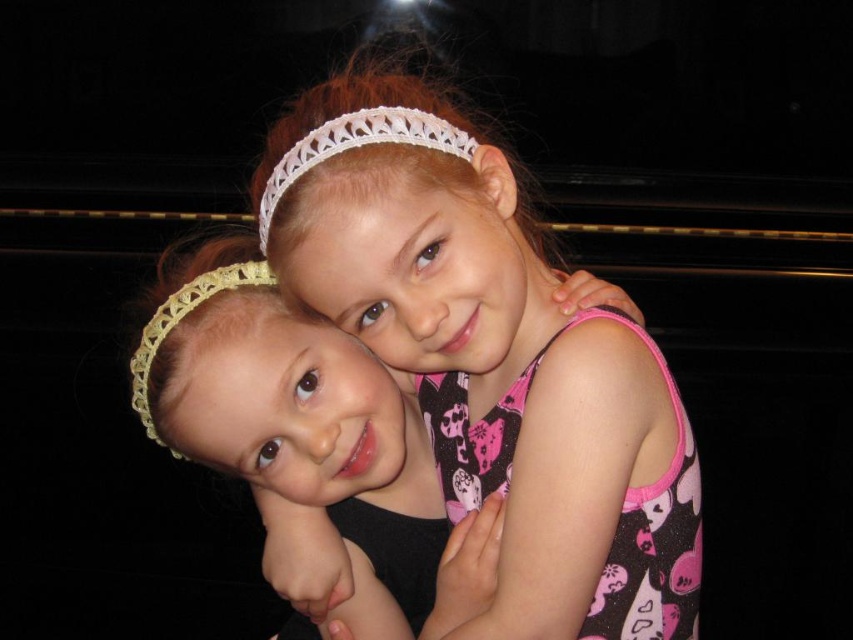
Can you confirm if white lace headband at upper center is positioned to the right of yellow crochet headband at left?

Yes, white lace headband at upper center is to the right of yellow crochet headband at left.

Describe the element at coordinates (357, 147) in the screenshot. I see `white lace headband at upper center` at that location.

The width and height of the screenshot is (853, 640). What do you see at coordinates (357, 147) in the screenshot? I see `white lace headband at upper center` at bounding box center [357, 147].

Image resolution: width=853 pixels, height=640 pixels. Identify the location of white lace headband at upper center. pos(357,147).

Does pink fabric dress at center have a lesser height compared to white lace headband at upper center?

No, pink fabric dress at center is not shorter than white lace headband at upper center.

You are a GUI agent. You are given a task and a screenshot of the screen. Output one action in this format:
    pyautogui.click(x=<x>, y=<y>)
    Task: Click on the pink fabric dress at center
    This screenshot has height=640, width=853.
    Given the screenshot: What is the action you would take?
    pyautogui.click(x=492, y=358)

Is the position of pink fabric dress at center more distant than that of yellow crochet headband at left?

No, it is in front of yellow crochet headband at left.

How far apart are pink fabric dress at center and yellow crochet headband at left?

They are 10.96 inches apart.

Where is `pink fabric dress at center`? The height and width of the screenshot is (640, 853). pink fabric dress at center is located at coordinates (492, 358).